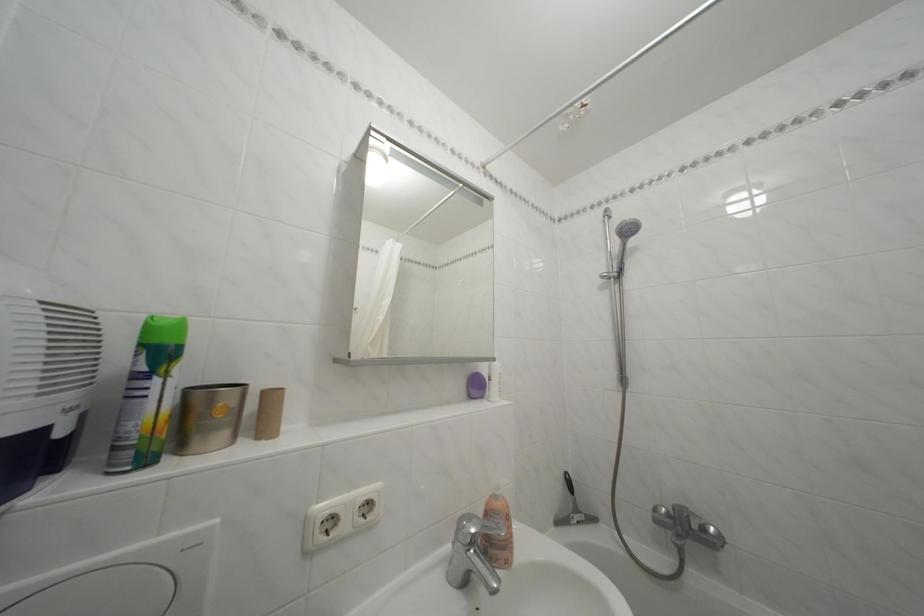
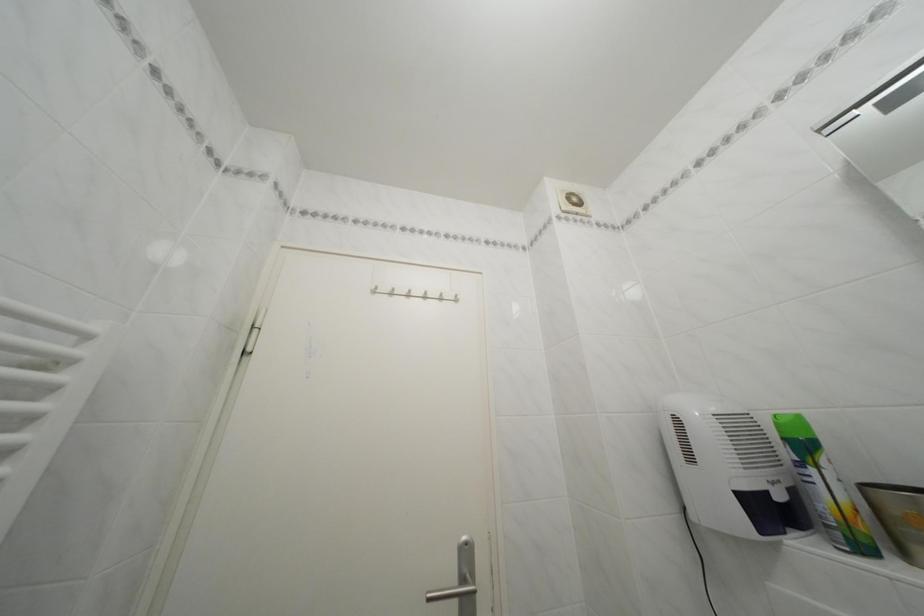
Looking at this image, the images are taken continuously from a first-person perspective. In which direction is your viewpoint rotating?

The camera's rotation is toward left-up.